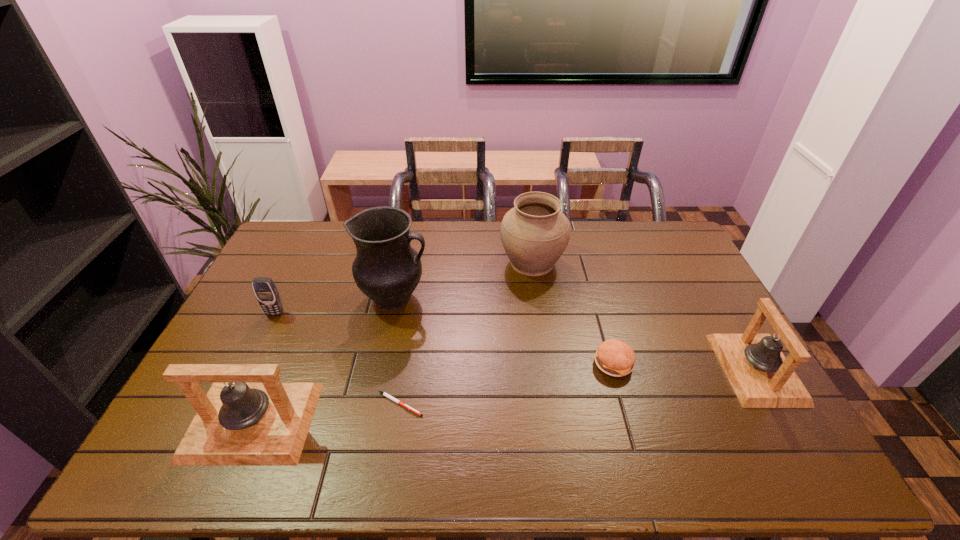
Locate an element on the screen. This screenshot has width=960, height=540. free space located on the back of the third tallest object is located at coordinates (288, 338).

You are a GUI agent. You are given a task and a screenshot of the screen. Output one action in this format:
    pyautogui.click(x=<x>, y=<y>)
    Task: Click on the vacant space situated on the back of the fourth shortest object
    
    Given the screenshot: What is the action you would take?
    pyautogui.click(x=698, y=268)

I want to click on vacant area situated 0.240m on the handle side of the pitcher, so click(x=503, y=298).

The width and height of the screenshot is (960, 540). What are the coordinates of `vacant area situated 0.070m on the back of the fifth object from left to right` in the screenshot? It's located at (528, 232).

The width and height of the screenshot is (960, 540). Find the location of `free spot located on the front face of the fifth tallest object`. free spot located on the front face of the fifth tallest object is located at coordinates (222, 423).

Where is `blank area located 0.290m on the clicker of the shortest object`? The image size is (960, 540). blank area located 0.290m on the clicker of the shortest object is located at coordinates (535, 404).

Locate an element on the screen. This screenshot has width=960, height=540. vacant space located on the back of the second object from right to left is located at coordinates (599, 314).

At what (x,y) coordinates should I click in order to perform the action: click on object situated at the far edge. Please return your answer as a coordinate pair (x, y). Looking at the image, I should click on (534, 233).

The image size is (960, 540). Find the location of `pen situated at the near edge`. pen situated at the near edge is located at coordinates (385, 394).

The height and width of the screenshot is (540, 960). In order to click on bell present at the left edge in this screenshot , I will do `click(237, 424)`.